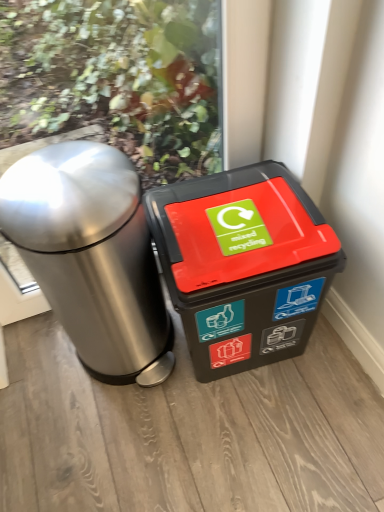
Where is `free spot in front of brushed metal trash can at left, which is the second waste container in right-to-left order`? This screenshot has height=512, width=384. free spot in front of brushed metal trash can at left, which is the second waste container in right-to-left order is located at coordinates pyautogui.click(x=124, y=441).